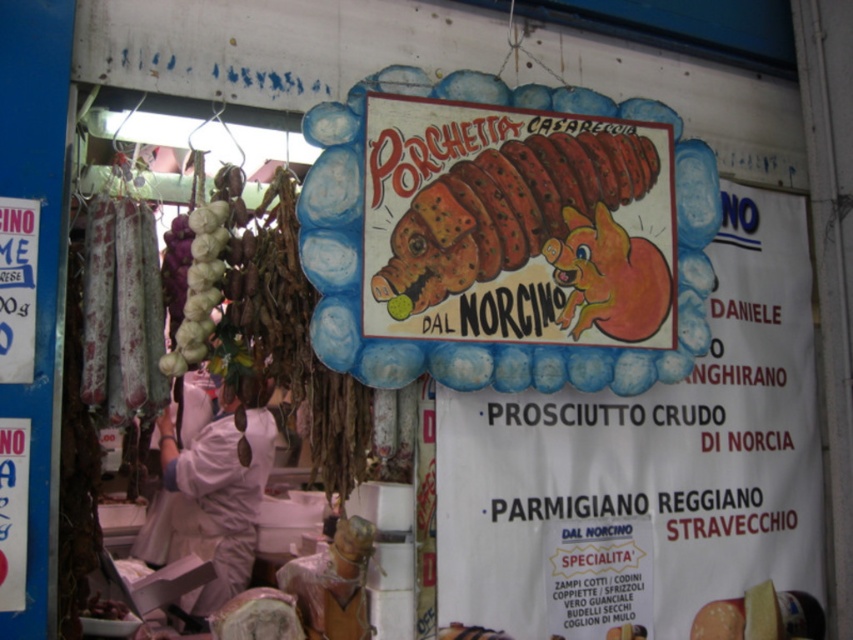
Between point (486, 548) and point (434, 260), which one is positioned in front?

Point (434, 260)

Which is below, matte orange pig at center or sliced brown meat at center?

matte orange pig at center is below.

Measure the distance between matte orange pig at center and camera.

A distance of 6.65 feet exists between matte orange pig at center and camera.

Where is `matte orange pig at center`? The width and height of the screenshot is (853, 640). matte orange pig at center is located at coordinates (653, 474).